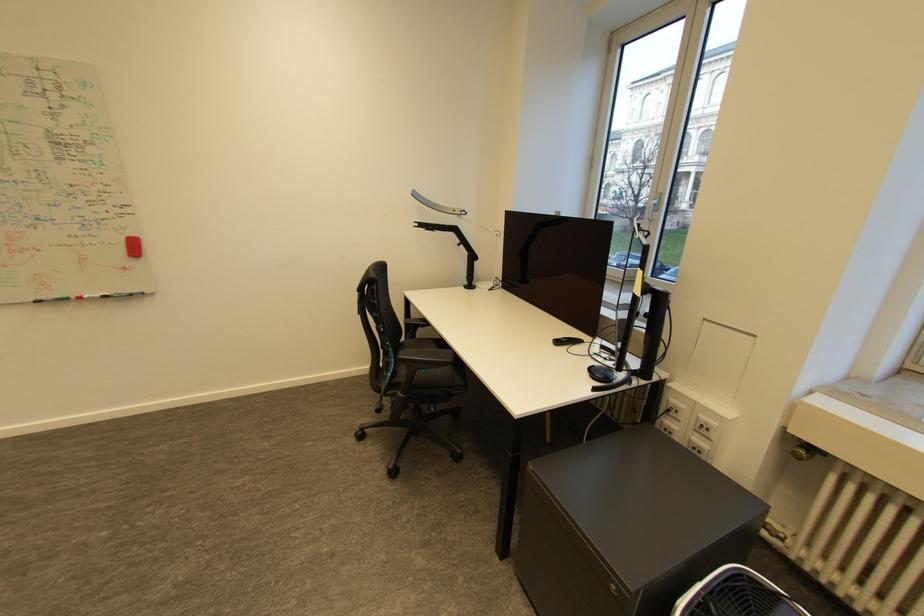
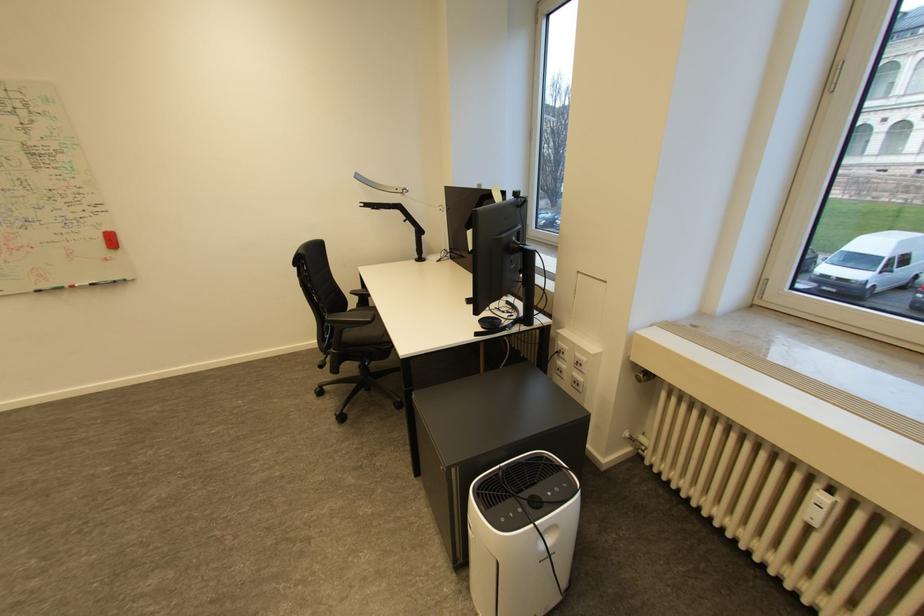
Where in the second image is the point corresponding to [407,342] from the first image?

(355, 310)